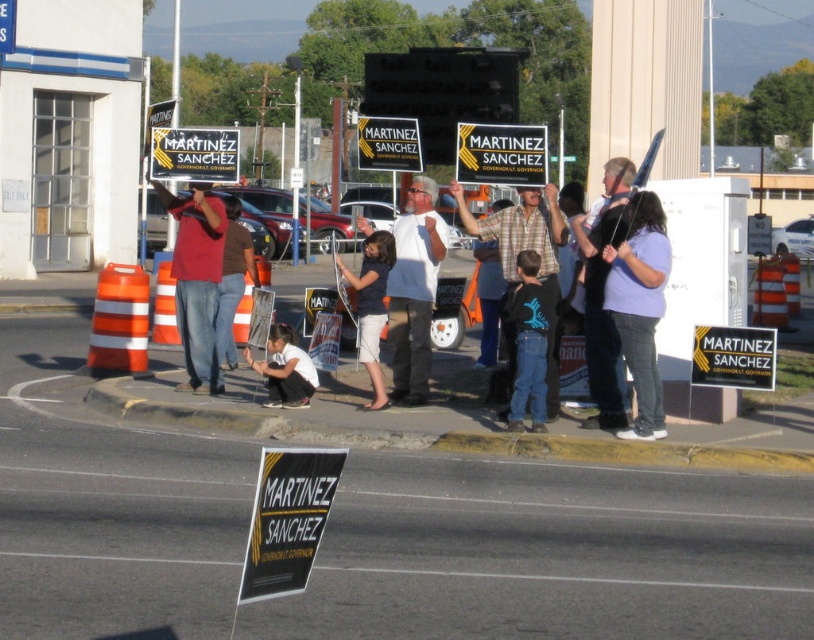
Based on the photo, you are a photographer standing at the edge of the event. You want to capture a photo of the dark blue fabric shirt at center and the yellow plastic sign at center without any obstructions. Given that your camera has a maximum focus range of 1.2 meters, will you be able to get both subjects in focus?

The dark blue fabric shirt at center is 1.32 meters away from the yellow plastic sign at center, which exceeds the camera maximum focus range of 1.2 meters. Therefore, you cannot get both subjects in focus.

Based on the photo, you are a photographer at the event and want to ensure the dark blue fabric shirt at center and the yellow plastic sign at center are both visible in your photo. Considering their heights, which one might you need to adjust your camera angle to capture fully?

The dark blue fabric shirt at center has a lesser height compared to the yellow plastic sign at center, so you might need to lower your camera angle to ensure the taller yellow plastic sign at center is fully captured while still including the shorter dark blue fabric shirt at center in the frame.